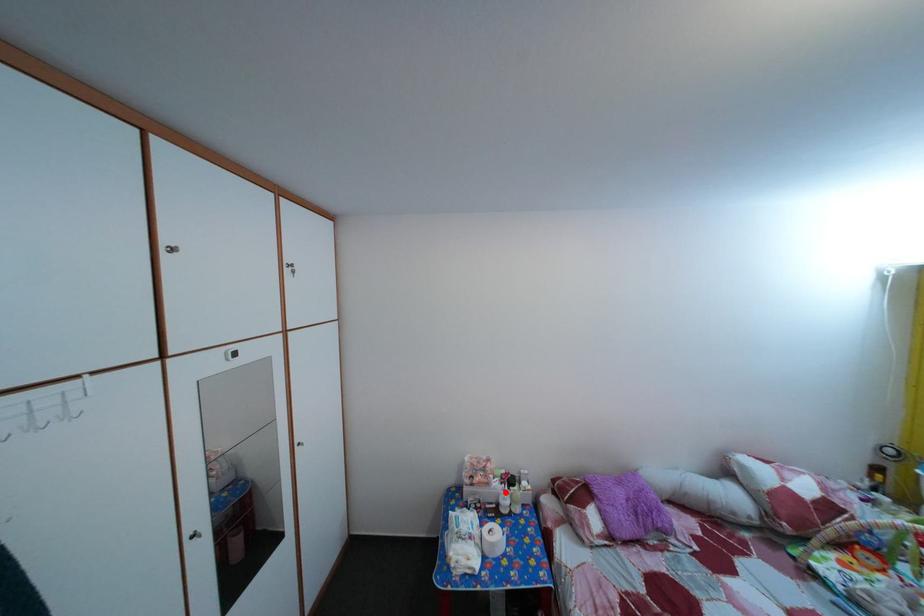
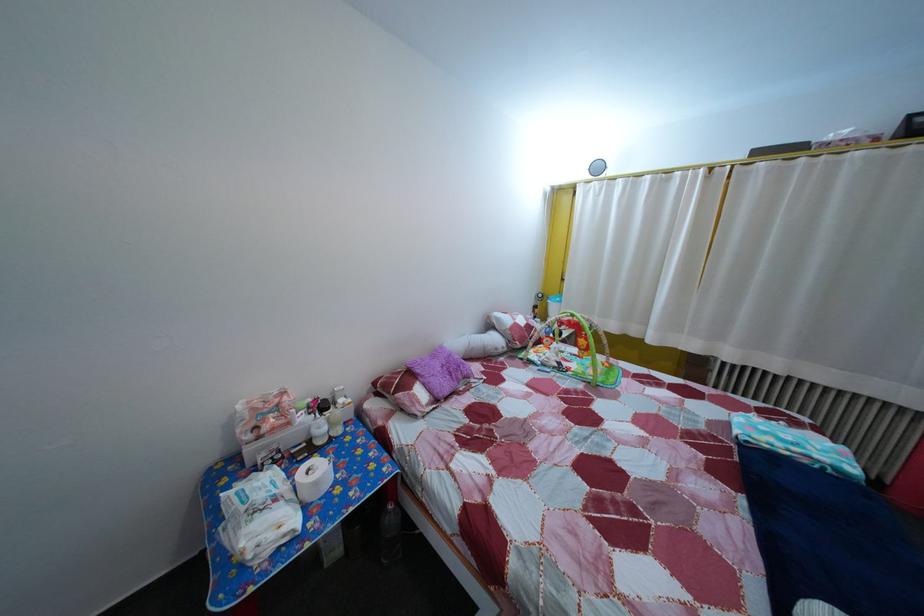
Question: I am providing you with two images of the same scene from different viewpoints. A red point is shown in image1. For the corresponding object point in image2, is it positioned nearer or farther from the camera?

Choices:
 (A) Nearer
 (B) Farther

Answer: (A)